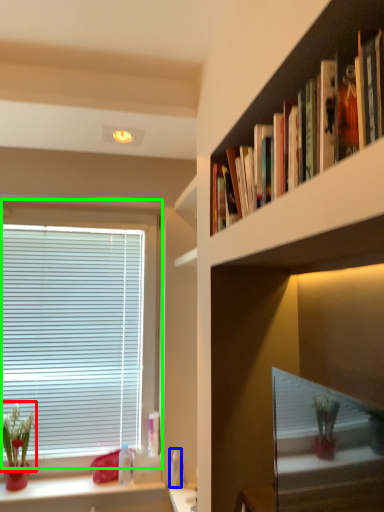
Question: Considering the real-world distances, which object is farthest from floral arrangement (highlighted by a red box)? toiletry (highlighted by a blue box) or window (highlighted by a green box)?

Choices:
 (A) toiletry
 (B) window

Answer: (A)